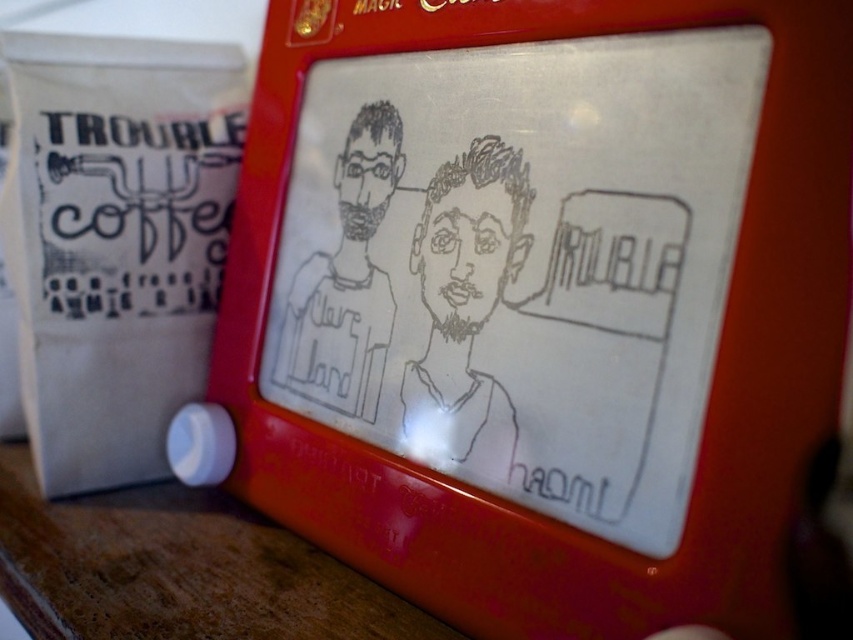
You are an art student analyzing the image. You notice two drawings on the screen of the red electronic device. The first is the black line drawing face at center, and the second is the black ink drawing of man at center. Which of these two drawings is wider?

The black ink drawing of man at center is wider than the black line drawing face at center.

What is located at the coordinates point [463,305]?

The black line drawing face at center is located at point [463,305].

What are the coordinates of the black line drawing face at center in the image?

The black line drawing face at center is located at coordinates point (x=463, y=305).